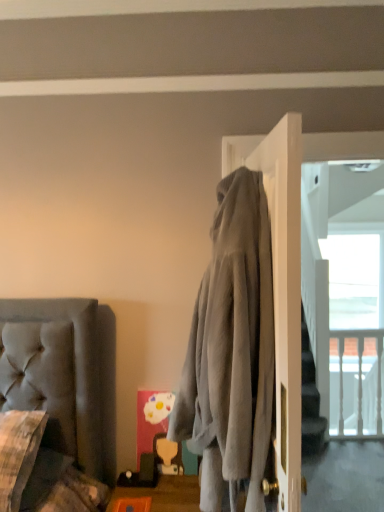
This screenshot has height=512, width=384. Describe the element at coordinates (351, 333) in the screenshot. I see `clear glass window at upper right` at that location.

Where is `plush gray couch at lower left`? Image resolution: width=384 pixels, height=512 pixels. plush gray couch at lower left is located at coordinates (41, 471).

This screenshot has width=384, height=512. I want to click on gray fabric screen door at upper right, so point(340,266).

Is gray fabric screen door at upper right to the left of orange plastic tray at lower center from the viewer's perspective?

No.

From the image's perspective, who appears lower, gray fabric screen door at upper right or orange plastic tray at lower center?

From the image's view, orange plastic tray at lower center is below.

Which point is more distant from viewer, (x=343, y=352) or (x=151, y=501)?

The point (x=343, y=352) is farther from the camera.

How distant is gray fabric screen door at upper right from plush gray couch at lower left?

A distance of 6.49 feet exists between gray fabric screen door at upper right and plush gray couch at lower left.

Can you confirm if gray fabric screen door at upper right is positioned to the right of plush gray couch at lower left?

Yes.

In terms of size, does gray fabric screen door at upper right appear bigger or smaller than plush gray couch at lower left?

Clearly, gray fabric screen door at upper right is larger in size than plush gray couch at lower left.

I want to click on screen door behind the plush gray couch at lower left, so click(340, 266).

Between clear glass window at upper right and gray fleece hoodie at center, which one is positioned behind?

clear glass window at upper right is further from the camera.

Locate an element on the screen. The height and width of the screenshot is (512, 384). window behind the gray fleece hoodie at center is located at coordinates (351, 333).

Considering the relative sizes of clear glass window at upper right and gray fleece hoodie at center in the image provided, is clear glass window at upper right smaller than gray fleece hoodie at center?

Yes, clear glass window at upper right is smaller than gray fleece hoodie at center.

From the picture: Is clear glass window at upper right positioned with its back to gray fleece hoodie at center?

clear glass window at upper right does not have its back to gray fleece hoodie at center.

Identify the location of window below the gray fabric screen door at upper right (from the image's perspective). Image resolution: width=384 pixels, height=512 pixels. (351, 333).

How far apart are gray fabric screen door at upper right and clear glass window at upper right?

gray fabric screen door at upper right and clear glass window at upper right are 12.47 centimeters apart.

Which is more to the right, gray fabric screen door at upper right or clear glass window at upper right?

Positioned to the right is clear glass window at upper right.

Is gray fabric screen door at upper right behind clear glass window at upper right?

No, it is not.

Does gray fleece hoodie at center have a lesser width compared to gray fabric screen door at upper right?

In fact, gray fleece hoodie at center might be wider than gray fabric screen door at upper right.

From a real-world perspective, which object stands above the other?

In real-world perspective, gray fabric screen door at upper right is above.

Considering the relative sizes of gray fleece hoodie at center and gray fabric screen door at upper right in the image provided, is gray fleece hoodie at center smaller than gray fabric screen door at upper right?

Actually, gray fleece hoodie at center might be larger than gray fabric screen door at upper right.

Is point (219, 477) farther from viewer compared to point (151, 494)?

That is False.

Is orange plastic tray at lower center at the back of gray fleece hoodie at center?

gray fleece hoodie at center does not have its back to orange plastic tray at lower center.

From a real-world perspective, is gray fleece hoodie at center over orange plastic tray at lower center?

Yes, from a real-world perspective, gray fleece hoodie at center is above orange plastic tray at lower center.

At what (x,y) coordinates should I click in order to perform the action: click on clothing on the right of orange plastic tray at lower center. Please return your answer as a coordinate pair (x, y). The image size is (384, 512). Looking at the image, I should click on pyautogui.click(x=231, y=349).

Is clear glass window at upper right directly adjacent to orange plastic tray at lower center?

clear glass window at upper right is not next to orange plastic tray at lower center, and they're not touching.

In terms of size, does clear glass window at upper right appear bigger or smaller than orange plastic tray at lower center?

Considering their sizes, clear glass window at upper right takes up more space than orange plastic tray at lower center.

From a real-world perspective, who is located higher, clear glass window at upper right or orange plastic tray at lower center?

clear glass window at upper right is physically above.

From the image's perspective, between clear glass window at upper right and orange plastic tray at lower center, which one is located above?

clear glass window at upper right appears higher in the image.

Locate an element on the screen. The height and width of the screenshot is (512, 384). screen door on the right side of orange plastic tray at lower center is located at coordinates (340, 266).

This screenshot has height=512, width=384. I want to click on couch in front of the gray fabric screen door at upper right, so click(x=41, y=471).

Looking at the image, which one is located further to orange plastic tray at lower center, clear glass window at upper right or plush gray couch at lower left?

Among the two, clear glass window at upper right is located further to orange plastic tray at lower center.

Based on their spatial positions, is gray fleece hoodie at center or gray fabric screen door at upper right further from orange plastic tray at lower center?

Among the two, gray fabric screen door at upper right is located further to orange plastic tray at lower center.

Considering their positions, is clear glass window at upper right positioned closer to gray fabric screen door at upper right than plush gray couch at lower left?

Among the two, clear glass window at upper right is located nearer to gray fabric screen door at upper right.

Based on the photo, based on their spatial positions, is gray fabric screen door at upper right or orange plastic tray at lower center further from clear glass window at upper right?

Based on the image, orange plastic tray at lower center appears to be further to clear glass window at upper right.

When comparing their distances from orange plastic tray at lower center, does gray fleece hoodie at center or clear glass window at upper right seem further?

clear glass window at upper right.

Estimate the real-world distances between objects in this image. Which object is further from gray fabric screen door at upper right, orange plastic tray at lower center or clear glass window at upper right?

orange plastic tray at lower center is further to gray fabric screen door at upper right.

From the image, which object appears to be nearer to gray fabric screen door at upper right, clear glass window at upper right or gray fleece hoodie at center?

clear glass window at upper right.

When comparing their distances from clear glass window at upper right, does orange plastic tray at lower center or gray fabric screen door at upper right seem closer?

gray fabric screen door at upper right lies closer to clear glass window at upper right than the other object.

You are a GUI agent. You are given a task and a screenshot of the screen. Output one action in this format:
    pyautogui.click(x=<x>, y=<y>)
    Task: Click on the clothing between gray fabric screen door at upper right and orange plastic tray at lower center vertically
    
    Given the screenshot: What is the action you would take?
    pyautogui.click(x=231, y=349)

The height and width of the screenshot is (512, 384). Identify the location of screen door between gray fleece hoodie at center and clear glass window at upper right from front to back. (340, 266).

You are a GUI agent. You are given a task and a screenshot of the screen. Output one action in this format:
    pyautogui.click(x=<x>, y=<y>)
    Task: Click on the clothing between plush gray couch at lower left and gray fabric screen door at upper right
    The image size is (384, 512).
    Given the screenshot: What is the action you would take?
    pyautogui.click(x=231, y=349)

Where is `table situated between plush gray couch at lower left and gray fabric screen door at upper right from left to right`? The image size is (384, 512). table situated between plush gray couch at lower left and gray fabric screen door at upper right from left to right is located at coordinates (164, 494).